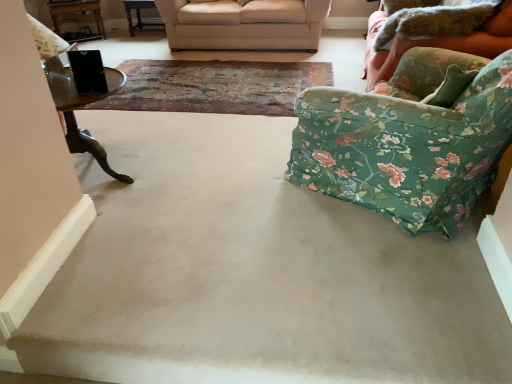
You are a GUI agent. You are given a task and a screenshot of the screen. Output one action in this format:
    pyautogui.click(x=<x>, y=<y>)
    Task: Click on the floral fabric armchair at right
    Image resolution: width=512 pixels, height=384 pixels.
    Given the screenshot: What is the action you would take?
    pyautogui.click(x=409, y=139)

How much space does wooden table at upper left, which ranks as the second table in right-to-left order, occupy vertically?

The height of wooden table at upper left, which ranks as the second table in right-to-left order, is 18.05 inches.

Where is `wooden table at upper left, which ranks as the second table in right-to-left order`? The width and height of the screenshot is (512, 384). wooden table at upper left, which ranks as the second table in right-to-left order is located at coordinates (76, 17).

At what (x,y) coordinates should I click in order to perform the action: click on worn leather mat at center. Please return your answer as a coordinate pair (x, y). The width and height of the screenshot is (512, 384). Looking at the image, I should click on (215, 86).

The image size is (512, 384). Describe the element at coordinates (252, 273) in the screenshot. I see `beige carpet at center` at that location.

At what (x,y) coordinates should I click in order to perform the action: click on floral fabric armchair at right. Please return your answer as a coordinate pair (x, y). Looking at the image, I should click on (409, 139).

What's the angular difference between worn leather mat at center and beige fabric couch at upper center, arranged as the 1th studio couch when viewed from the left,'s facing directions?

0.0203 degrees.

Which of these two, worn leather mat at center or beige fabric couch at upper center, the second studio couch positioned from the right, is wider?

With larger width is worn leather mat at center.

From the image's perspective, is worn leather mat at center below beige fabric couch at upper center, acting as the second studio couch starting from the front?

Yes.

Based on the photo, who is bigger, worn leather mat at center or beige fabric couch at upper center, which is the first studio couch in back-to-front order?

beige fabric couch at upper center, which is the first studio couch in back-to-front order, is bigger.

Looking at this image, are worn leather mat at center and floral fabric armchair at right beside each other?

There is a gap between worn leather mat at center and floral fabric armchair at right.

From a real-world perspective, between worn leather mat at center and floral fabric armchair at right, who is vertically higher?

floral fabric armchair at right is physically above.

Which object is more forward, worn leather mat at center or floral fabric armchair at right?

floral fabric armchair at right is closer to the camera.

Is point (274, 76) closer or farther from the camera than point (404, 112)?

Clearly, point (274, 76) is more distant from the camera than point (404, 112).

How far apart are worn leather mat at center and wooden table at center, marked as the 2th table in a left-to-right arrangement?

worn leather mat at center is 4.34 feet away from wooden table at center, marked as the 2th table in a left-to-right arrangement.

Is worn leather mat at center turned away from wooden table at center, placed as the 1th table when sorted from right to left?

That's not correct — worn leather mat at center is not looking away from wooden table at center, placed as the 1th table when sorted from right to left.

From the image's perspective, is worn leather mat at center above or below wooden table at center, placed as the 1th table when sorted from right to left?

From the image's perspective, worn leather mat at center appears below wooden table at center, placed as the 1th table when sorted from right to left.

Is the position of worn leather mat at center more distant than that of wooden table at upper left, which ranks as the second table in right-to-left order?

No, it is in front of wooden table at upper left, which ranks as the second table in right-to-left order.

How many degrees apart are the facing directions of worn leather mat at center and wooden table at upper left, the first table when ordered from left to right?

The angular difference between worn leather mat at center and wooden table at upper left, the first table when ordered from left to right, is 37.6 degrees.

Is worn leather mat at center turned away from wooden table at upper left, the first table when ordered from left to right?

No, wooden table at upper left, the first table when ordered from left to right, is not at the back of worn leather mat at center.

In the scene shown: Is worn leather mat at center next to wooden table at upper left, which ranks as the second table in right-to-left order, and touching it?

worn leather mat at center and wooden table at upper left, which ranks as the second table in right-to-left order, are clearly separated.

Can you confirm if wooden table at center, marked as the 2th table in a left-to-right arrangement, is taller than floral fabric armchair at right?

Incorrect, the height of wooden table at center, marked as the 2th table in a left-to-right arrangement, is not larger of that of floral fabric armchair at right.

Can you confirm if wooden table at center, placed as the 1th table when sorted from right to left, is bigger than floral fabric armchair at right?

No.

Is wooden table at center, placed as the 1th table when sorted from right to left, positioned beyond the bounds of floral fabric armchair at right?

Yes, wooden table at center, placed as the 1th table when sorted from right to left, is located beyond the bounds of floral fabric armchair at right.

Can you confirm if wooden table at center, placed as the 1th table when sorted from right to left, is positioned to the left of floral fabric armchair at right?

Yes.

Would you consider beige fabric couch at upper center, the second studio couch positioned from the right, to be distant from floral fabric studio couch at right, the 2th studio couch positioned from the back?

Yes, beige fabric couch at upper center, the second studio couch positioned from the right, is far from floral fabric studio couch at right, the 2th studio couch positioned from the back.

Can you tell me how much beige fabric couch at upper center, the second studio couch positioned from the right, and floral fabric studio couch at right, the 1th studio couch positioned from the right, differ in facing direction?

The angular difference between beige fabric couch at upper center, the second studio couch positioned from the right, and floral fabric studio couch at right, the 1th studio couch positioned from the right, is 94.9 degrees.

Is beige fabric couch at upper center, arranged as the 1th studio couch when viewed from the left, located outside floral fabric studio couch at right, the 2th studio couch positioned from the back?

Yes, beige fabric couch at upper center, arranged as the 1th studio couch when viewed from the left, is not within floral fabric studio couch at right, the 2th studio couch positioned from the back.

Between point (271, 33) and point (431, 42), which one is positioned in front?

Point (431, 42)

Considering the relative sizes of floral fabric studio couch at right, the first studio couch when ordered from front to back, and worn leather mat at center in the image provided, is floral fabric studio couch at right, the first studio couch when ordered from front to back, smaller than worn leather mat at center?

Actually, floral fabric studio couch at right, the first studio couch when ordered from front to back, might be larger than worn leather mat at center.

Is point (482, 29) more distant than point (137, 107)?

No, it is not.

Looking at this image, in the image, is floral fabric studio couch at right, the 1th studio couch positioned from the right, on the left side or the right side of worn leather mat at center?

In the image, floral fabric studio couch at right, the 1th studio couch positioned from the right, appears on the right side of worn leather mat at center.

Consider the image. From a real-world perspective, between floral fabric studio couch at right, the 2th studio couch viewed from the left, and worn leather mat at center, who is vertically lower?

In real-world perspective, worn leather mat at center is lower.

Image resolution: width=512 pixels, height=384 pixels. What are the coordinates of `studio couch that is the 2nd one when counting upward from the worn leather mat at center (from the image's perspective)` in the screenshot? It's located at (244, 24).

Where is `mat that appears behind the floral fabric armchair at right`? mat that appears behind the floral fabric armchair at right is located at coordinates (215, 86).

Based on their spatial positions, is beige fabric couch at upper center, acting as the second studio couch starting from the front, or beige carpet at center closer to floral fabric armchair at right?

beige carpet at center is positioned closer to the anchor floral fabric armchair at right.

When comparing their distances from floral fabric armchair at right, does floral fabric studio couch at right, the 1th studio couch positioned from the right, or beige carpet at center seem closer?

Based on the image, beige carpet at center appears to be nearer to floral fabric armchair at right.

When comparing their distances from worn leather mat at center, does wooden table at upper left, the first table when ordered from left to right, or floral fabric armchair at right seem closer?

wooden table at upper left, the first table when ordered from left to right, lies closer to worn leather mat at center than the other object.

Which object lies nearer to the anchor point worn leather mat at center, floral fabric studio couch at right, the 2th studio couch viewed from the left, or beige fabric couch at upper center, acting as the second studio couch starting from the front?

Based on the image, beige fabric couch at upper center, acting as the second studio couch starting from the front, appears to be nearer to worn leather mat at center.

Which object lies nearer to the anchor point beige fabric couch at upper center, acting as the second studio couch starting from the front, worn leather mat at center or beige carpet at center?

worn leather mat at center is positioned closer to the anchor beige fabric couch at upper center, acting as the second studio couch starting from the front.

Considering their positions, is wooden table at upper left, the first table when ordered from left to right, positioned closer to floral fabric armchair at right than beige carpet at center?

beige carpet at center is positioned closer to the anchor floral fabric armchair at right.

Which object lies further to the anchor point beige carpet at center, beige fabric couch at upper center, the second studio couch positioned from the right, or wooden table at center, marked as the 2th table in a left-to-right arrangement?

wooden table at center, marked as the 2th table in a left-to-right arrangement.

Which object lies further to the anchor point floral fabric armchair at right, wooden table at center, placed as the 1th table when sorted from right to left, or wooden table at upper left, the first table when ordered from left to right?

wooden table at upper left, the first table when ordered from left to right, is positioned further to the anchor floral fabric armchair at right.

What are the coordinates of `studio couch between wooden table at upper left, which ranks as the second table in right-to-left order, and floral fabric studio couch at right, the 2th studio couch viewed from the left` in the screenshot? It's located at (244, 24).

Locate an element on the screen. table between beige carpet at center and wooden table at center, placed as the 1th table when sorted from right to left, along the z-axis is located at coordinates (76, 17).

Where is `mat between beige carpet at center and beige fabric couch at upper center, which is the first studio couch in back-to-front order, along the z-axis`? mat between beige carpet at center and beige fabric couch at upper center, which is the first studio couch in back-to-front order, along the z-axis is located at coordinates (215, 86).

Find the location of a particular element. The height and width of the screenshot is (384, 512). chair between wooden table at upper left, the first table when ordered from left to right, and floral fabric studio couch at right, the first studio couch when ordered from front to back, from left to right is located at coordinates (409, 139).